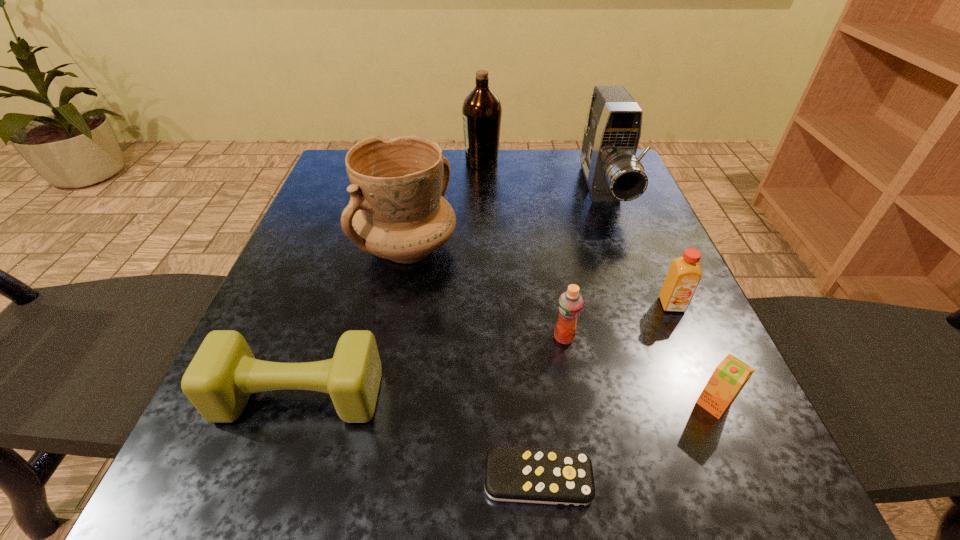
Locate an element on the screen. This screenshot has height=540, width=960. vacant point located 0.340m on the label of the olive oil is located at coordinates (334, 161).

Where is `free space located on the label of the olive oil`? The height and width of the screenshot is (540, 960). free space located on the label of the olive oil is located at coordinates [353, 161].

Identify the location of vacant position located 0.280m on the label of the olive oil. (357, 161).

Where is `vacant space situated at the front of the camcorder, highlighting the lens`? This screenshot has width=960, height=540. vacant space situated at the front of the camcorder, highlighting the lens is located at coordinates (646, 300).

The image size is (960, 540). Identify the location of blank space located on the front of the pottery. (386, 366).

Image resolution: width=960 pixels, height=540 pixels. In order to click on free space located on the front and back of the farthest orange juice in this screenshot , I will do `click(685, 336)`.

This screenshot has width=960, height=540. Identify the location of free space located on the front of the leftmost orange juice. (583, 441).

Where is `free space located 0.090m on the back of the dumbbell`? free space located 0.090m on the back of the dumbbell is located at coordinates (324, 324).

Locate an element on the screen. This screenshot has width=960, height=540. vacant space situated on the left of the nearest orange juice is located at coordinates (523, 404).

This screenshot has height=540, width=960. Find the location of `vacant space located on the left of the remote control`. vacant space located on the left of the remote control is located at coordinates (279, 478).